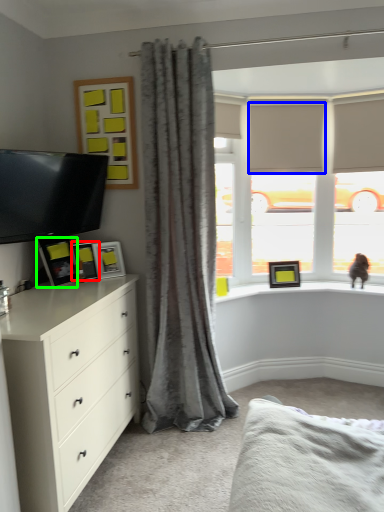
Question: Based on their relative distances, which object is nearer to picture frame (highlighted by a red box)? Choose from blind (highlighted by a blue box) and picture frame (highlighted by a green box).

Choices:
 (A) blind
 (B) picture frame

Answer: (B)